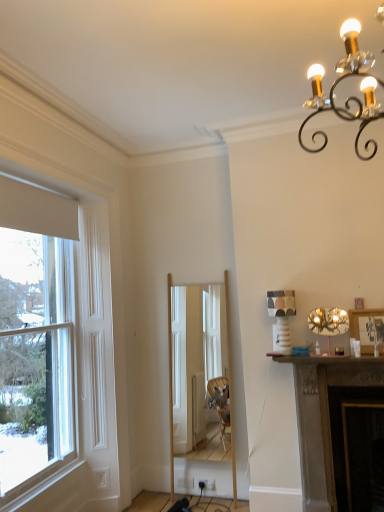
Question: Can you confirm if metallic gold chandelier at upper right is smaller than white wood window at left?

Choices:
 (A) no
 (B) yes

Answer: (B)

Question: Is metallic gold chandelier at upper right oriented towards white wood window at left?

Choices:
 (A) no
 (B) yes

Answer: (A)

Question: Does metallic gold chandelier at upper right have a lesser height compared to white wood window at left?

Choices:
 (A) no
 (B) yes

Answer: (B)

Question: Is the surface of metallic gold chandelier at upper right in direct contact with white wood window at left?

Choices:
 (A) yes
 (B) no

Answer: (B)

Question: Are metallic gold chandelier at upper right and white wood window at left far apart?

Choices:
 (A) no
 (B) yes

Answer: (B)

Question: Can you confirm if metallic gold chandelier at upper right is wider than white wood window at left?

Choices:
 (A) yes
 (B) no

Answer: (A)

Question: Is natural wood mirror at center oriented towards white wood window at left?

Choices:
 (A) no
 (B) yes

Answer: (A)

Question: Is natural wood mirror at center positioned behind white wood window at left?

Choices:
 (A) no
 (B) yes

Answer: (B)

Question: From a real-world perspective, is natural wood mirror at center over white wood window at left?

Choices:
 (A) yes
 (B) no

Answer: (B)

Question: Is natural wood mirror at center closer to camera compared to white wood window at left?

Choices:
 (A) yes
 (B) no

Answer: (B)

Question: Does natural wood mirror at center have a larger size compared to white wood window at left?

Choices:
 (A) yes
 (B) no

Answer: (B)

Question: Can you confirm if natural wood mirror at center is smaller than white wood window at left?

Choices:
 (A) no
 (B) yes

Answer: (B)

Question: Considering the relative sizes of metallic gold chandelier at upper right and dark brown stone fireplace at lower right in the image provided, is metallic gold chandelier at upper right thinner than dark brown stone fireplace at lower right?

Choices:
 (A) yes
 (B) no

Answer: (A)